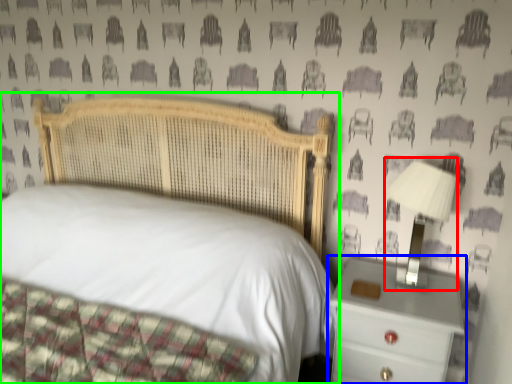
Question: Which object is the closest to the bedside lamp (highlighted by a red box)? Choose among these: nightstand (highlighted by a blue box) or bed (highlighted by a green box).

Choices:
 (A) nightstand
 (B) bed

Answer: (A)